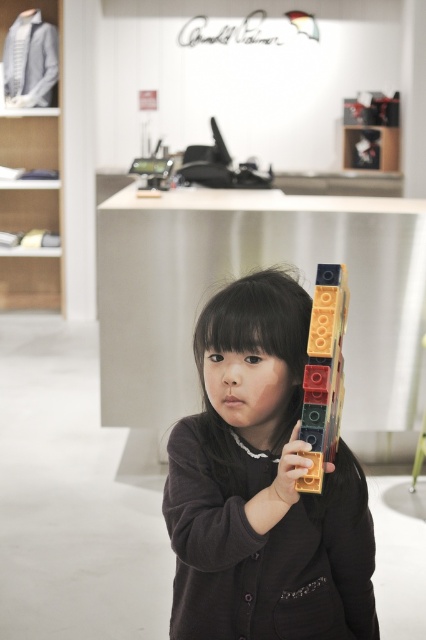
Question: Does translucent plastic blocks at center appear on the left side of gold plastic toy blocks at center?

Choices:
 (A) no
 (B) yes

Answer: (A)

Question: Which object is farther from the camera taking this photo?

Choices:
 (A) translucent plastic blocks at center
 (B) matte plastic blocks at center

Answer: (B)

Question: Based on their relative distances, which object is nearer to the matte plastic blocks at center?

Choices:
 (A) gold plastic toy blocks at center
 (B) translucent plastic blocks at center

Answer: (B)

Question: Can you confirm if matte plastic blocks at center is positioned below translucent plastic blocks at center?

Choices:
 (A) yes
 (B) no

Answer: (A)

Question: Can you confirm if translucent plastic blocks at center is smaller than gold plastic toy blocks at center?

Choices:
 (A) no
 (B) yes

Answer: (A)

Question: Which object appears farthest from the camera in this image?

Choices:
 (A) translucent plastic blocks at center
 (B) matte plastic blocks at center

Answer: (B)